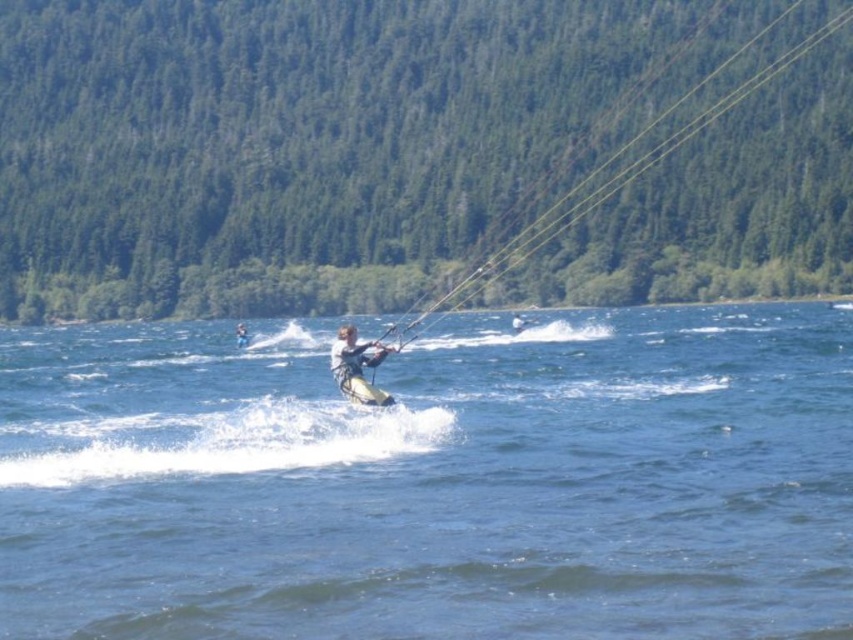
You are a drone operator trying to capture the best aerial shot of the blue water at center. The drone has a camera with a field of view that can capture a 1.2 meter radius around any point. If you position the drone directly above point (432,480), will the camera capture the blue water at center within its field of view?

Yes, because the point (432,480) directly indicates the blue water at center, positioning the drone above this point ensures the blue water at center is within the 1.2 meter radius field of view.